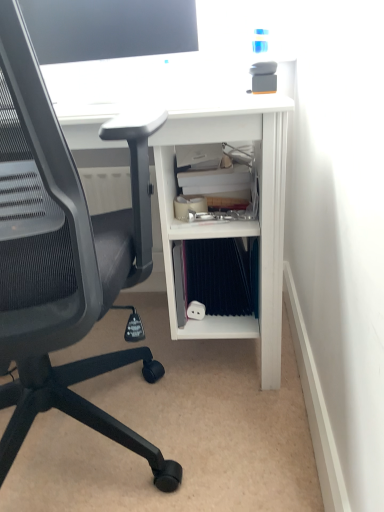
Question: Is matte black monitor at upper center taller than blue fabric binder at lower center?

Choices:
 (A) yes
 (B) no

Answer: (A)

Question: From a real-world perspective, does matte black monitor at upper center sit lower than blue fabric binder at lower center?

Choices:
 (A) yes
 (B) no

Answer: (B)

Question: Is blue fabric binder at lower center at the back of matte black monitor at upper center?

Choices:
 (A) no
 (B) yes

Answer: (A)

Question: Does matte black monitor at upper center have a smaller size compared to blue fabric binder at lower center?

Choices:
 (A) no
 (B) yes

Answer: (A)

Question: From the image's perspective, is matte black monitor at upper center over blue fabric binder at lower center?

Choices:
 (A) yes
 (B) no

Answer: (A)

Question: Is white matte desk at center bigger or smaller than blue fabric binder at lower center?

Choices:
 (A) big
 (B) small

Answer: (A)

Question: In terms of width, does white matte desk at center look wider or thinner when compared to blue fabric binder at lower center?

Choices:
 (A) wide
 (B) thin

Answer: (A)

Question: From a real-world perspective, is white matte desk at center physically located above or below blue fabric binder at lower center?

Choices:
 (A) below
 (B) above

Answer: (B)

Question: Based on their positions, is white matte desk at center located to the left or right of blue fabric binder at lower center?

Choices:
 (A) left
 (B) right

Answer: (A)

Question: From a real-world perspective, is black mesh chair at left above or below white matte desk at center?

Choices:
 (A) below
 (B) above

Answer: (B)

Question: Is black mesh chair at left inside the boundaries of white matte desk at center, or outside?

Choices:
 (A) inside
 (B) outside

Answer: (B)

Question: Is black mesh chair at left in front of or behind white matte desk at center in the image?

Choices:
 (A) behind
 (B) front

Answer: (B)

Question: Considering the relative positions of black mesh chair at left and white matte desk at center in the image provided, is black mesh chair at left to the left or to the right of white matte desk at center?

Choices:
 (A) left
 (B) right

Answer: (A)

Question: From the image's perspective, is white matte desk at center located above or below black mesh chair at left?

Choices:
 (A) below
 (B) above

Answer: (B)

Question: Based on their positions, is white matte desk at center located to the left or right of black mesh chair at left?

Choices:
 (A) left
 (B) right

Answer: (B)